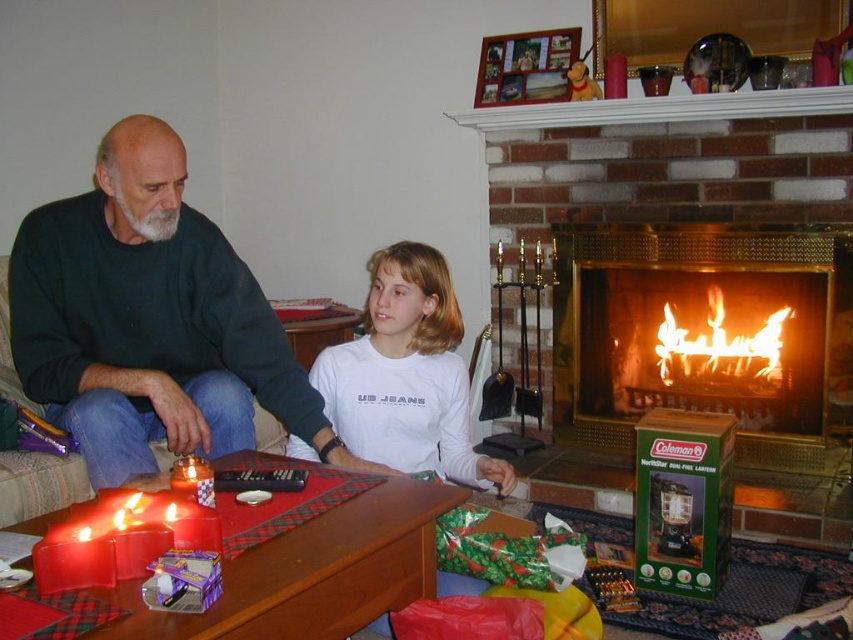
Question: Does dark green sweater at left appear on the left side of flamematerial/texture at position?

Choices:
 (A) no
 (B) yes

Answer: (B)

Question: Is flamematerial/texture at position below matte red candle at lower left?

Choices:
 (A) yes
 (B) no

Answer: (B)

Question: Which of the following is the farthest from the observer?

Choices:
 (A) dark green sweater at left
 (B) matte red candle at lower left
 (C) flamematerial/texture at position
 (D) white matte shirt at center

Answer: (C)

Question: Which object is the closest to the brass fireplace at center?

Choices:
 (A) dark green sweater at left
 (B) matte red candle at lower left
 (C) white matte shirt at center

Answer: (C)

Question: Among these objects, which one is farthest from the camera?

Choices:
 (A) brass fireplace at center
 (B) matte red candle at lower left
 (C) flamematerial/texture at position
 (D) dark green sweater at left

Answer: (C)

Question: Can you confirm if dark green sweater at left is thinner than flamematerial/texture at position?

Choices:
 (A) no
 (B) yes

Answer: (A)